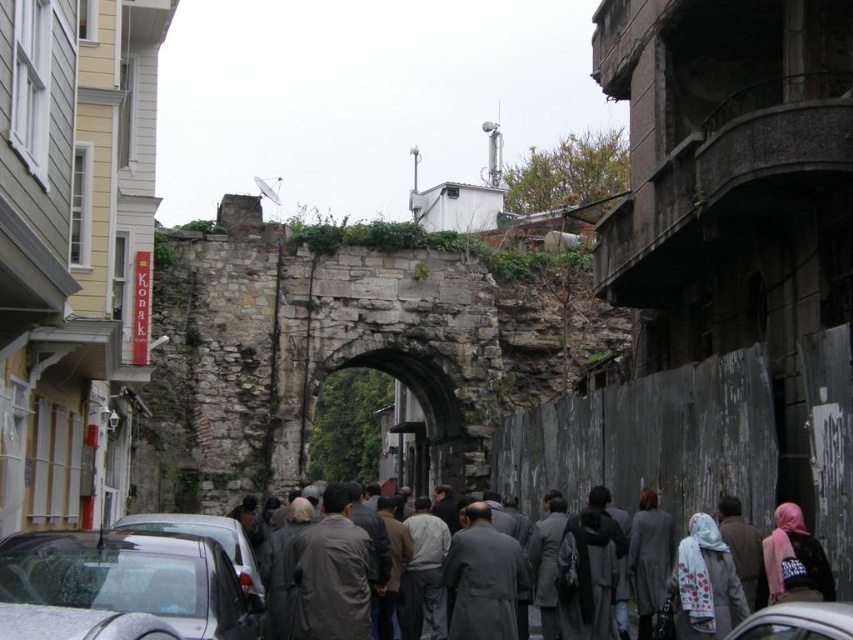
In the scene shown: Between shiny black car at lower left and gray woolen coats at center, which one is positioned lower?

gray woolen coats at center is below.

Consider the image. Which of these two, shiny black car at lower left or gray woolen coats at center, stands shorter?

Standing shorter between the two is shiny black car at lower left.

What do you see at coordinates (131, 577) in the screenshot? The image size is (853, 640). I see `shiny black car at lower left` at bounding box center [131, 577].

Where is `shiny black car at lower left`? The width and height of the screenshot is (853, 640). shiny black car at lower left is located at coordinates (131, 577).

Can you confirm if pink fabric headscarf at lower right is bigger than white glossy car at lower center?

No, pink fabric headscarf at lower right is not bigger than white glossy car at lower center.

Which is below, pink fabric headscarf at lower right or white glossy car at lower center?

pink fabric headscarf at lower right is below.

Between point (825, 579) and point (811, 621), which one is positioned behind?

Positioned behind is point (825, 579).

What are the coordinates of `pink fabric headscarf at lower right` in the screenshot? It's located at 792,556.

Is point (196, 600) more distant than point (711, 518)?

No, it is in front of (711, 518).

Measure the distance between shiny black car at lower left and white floral scarf at center.

They are 31.35 meters apart.

Between point (97, 564) and point (682, 561), which one is positioned in front?

Point (97, 564) is more forward.

Locate an element on the screen. The image size is (853, 640). shiny black car at lower left is located at coordinates (131, 577).